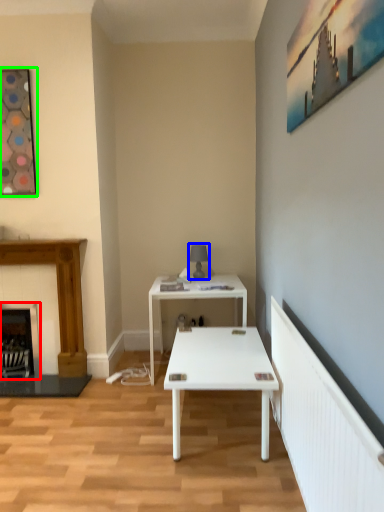
Question: Which is nearer to the fireplace (highlighted by a red box)? table lamp (highlighted by a blue box) or picture frame (highlighted by a green box).

Choices:
 (A) table lamp
 (B) picture frame

Answer: (B)